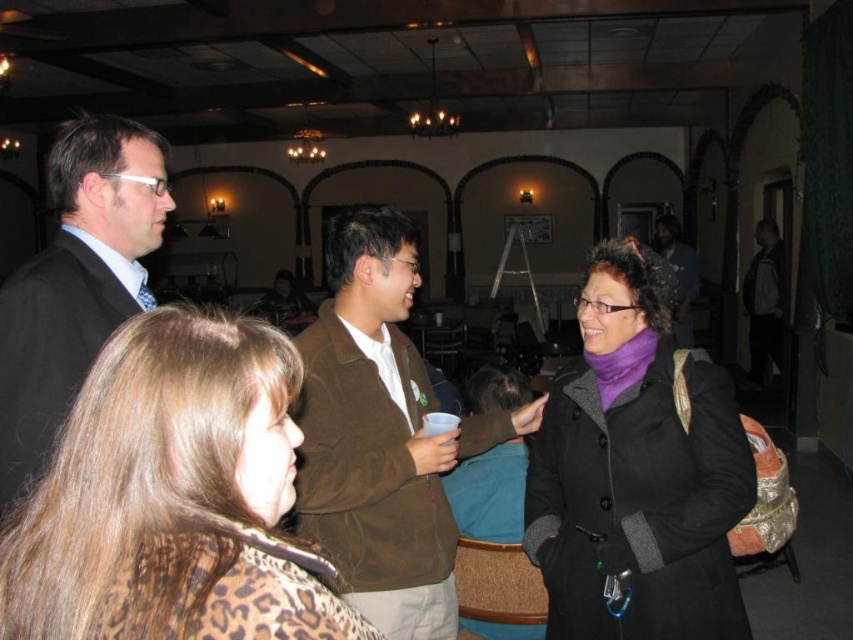
This screenshot has height=640, width=853. Identify the location of brown suede jacket at center. (381, 435).

What do you see at coordinates (381, 435) in the screenshot? The width and height of the screenshot is (853, 640). I see `brown suede jacket at center` at bounding box center [381, 435].

The image size is (853, 640). What do you see at coordinates (381, 435) in the screenshot? I see `brown suede jacket at center` at bounding box center [381, 435].

Where is `brown suede jacket at center`? brown suede jacket at center is located at coordinates (381, 435).

Does matte black suit at left have a greater width compared to dark gray jacket at right?

In fact, matte black suit at left might be narrower than dark gray jacket at right.

Can you confirm if matte black suit at left is positioned to the left of dark gray jacket at right?

Yes, matte black suit at left is to the left of dark gray jacket at right.

Find the location of `matte black suit at left`. matte black suit at left is located at coordinates (76, 282).

The image size is (853, 640). Find the location of `matte black suit at left`. matte black suit at left is located at coordinates (76, 282).

Who is more distant from viewer, (416, 576) or (7, 392)?

The point (416, 576) is more distant.

Who is more distant from viewer, [347,440] or [67,285]?

Positioned behind is point [347,440].

The image size is (853, 640). Find the location of `brown suede jacket at center`. brown suede jacket at center is located at coordinates (381, 435).